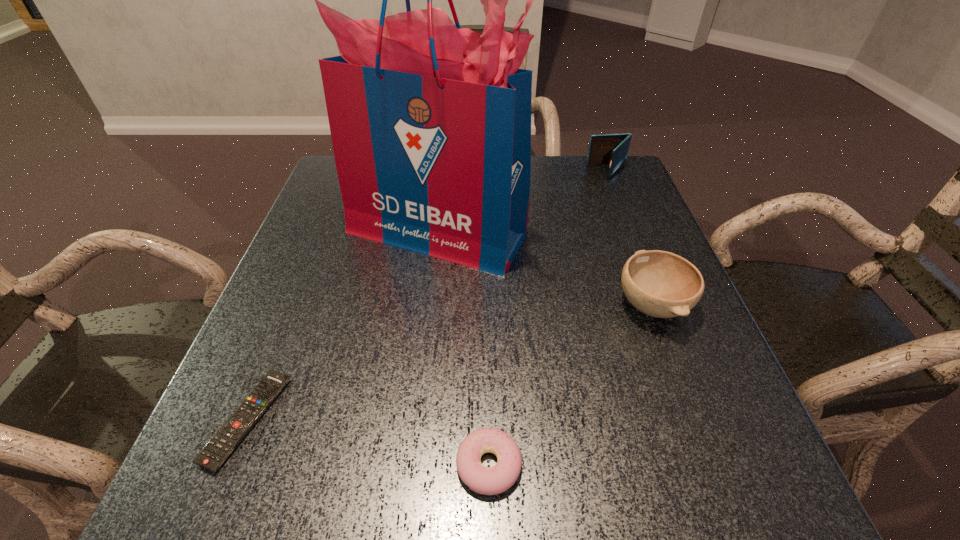
You are a GUI agent. You are given a task and a screenshot of the screen. Output one action in this format:
    pyautogui.click(x=<x>, y=<y>)
    Task: Click on the vacant region between the second shortest object and the grocery bag
    The width and height of the screenshot is (960, 540).
    Given the screenshot: What is the action you would take?
    pyautogui.click(x=463, y=348)

Identify the location of vacant area between the tallest object and the doughnut. (463, 348).

What are the coordinates of `vacant space that is in between the doughnut and the shortest object` in the screenshot? It's located at (368, 442).

I want to click on free space between the remote control and the bowl, so click(449, 362).

Locate an element on the screen. unoccupied position between the bowl and the second shortest object is located at coordinates (570, 385).

Where is `free space between the remote control and the bowl`? The width and height of the screenshot is (960, 540). free space between the remote control and the bowl is located at coordinates (449, 362).

Locate an element on the screen. The width and height of the screenshot is (960, 540). free spot between the bowl and the shortest object is located at coordinates (449, 362).

Locate an element on the screen. This screenshot has width=960, height=540. free space between the grocery bag and the shortest object is located at coordinates (342, 326).

What are the coordinates of `vacant region between the shortest object and the grocery bag` in the screenshot? It's located at (342, 326).

Choose which object is the nearest neighbor to the shortest object. Please provide its 2D coordinates. Your answer should be formatted as a tuple, i.e. [(x, y)], where the tuple contains the x and y coordinates of a point satisfying the conditions above.

[(430, 123)]